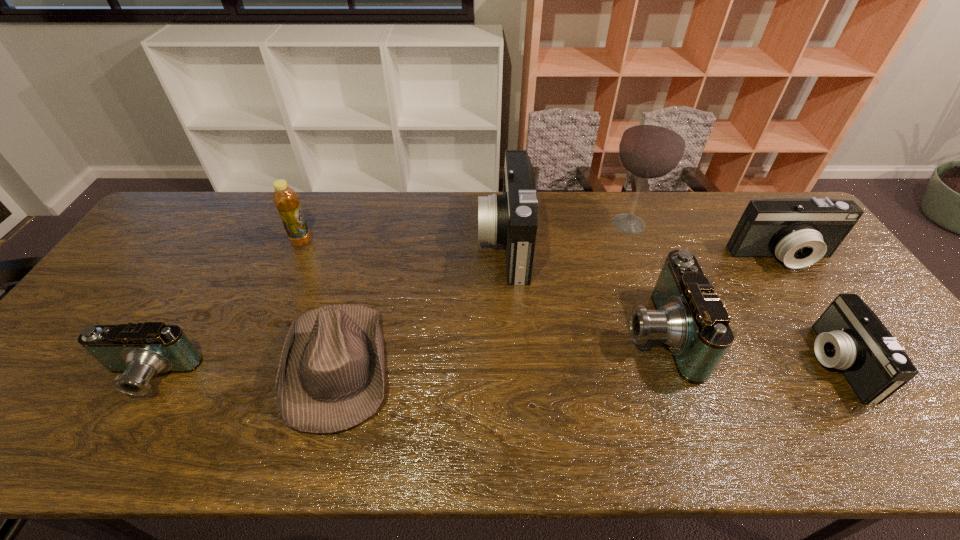
This screenshot has width=960, height=540. I want to click on free space located on the front-facing side of the third camcorder from right to left, so click(485, 333).

This screenshot has height=540, width=960. I want to click on vacant space located 0.190m on the lens of the nearest black camcorder, so click(737, 363).

You are a GUI agent. You are given a task and a screenshot of the screen. Output one action in this format:
    pyautogui.click(x=<x>, y=<y>)
    Task: Click on the vacant space positioned 0.320m on the lens of the nearest black camcorder
    This screenshot has height=540, width=960.
    Given the screenshot: What is the action you would take?
    pyautogui.click(x=684, y=363)

This screenshot has height=540, width=960. Find the location of `vacant region located on the lens of the nearest black camcorder`. vacant region located on the lens of the nearest black camcorder is located at coordinates (725, 363).

At what (x,y) coordinates should I click in order to perform the action: click on vacant space situated 0.130m on the back of the fedora. Please return your answer as a coordinate pair (x, y). The height and width of the screenshot is (540, 960). Looking at the image, I should click on (364, 273).

In order to click on alcohol positioned at the far edge in this screenshot , I will do `click(652, 146)`.

The width and height of the screenshot is (960, 540). Identify the location of camcorder positioned at the far edge. (510, 218).

The image size is (960, 540). What are the coordinates of `bottle present at the far edge` in the screenshot? It's located at (286, 201).

At what (x,y) coordinates should I click in order to perform the action: click on object that is at the near edge. Please return your answer as a coordinate pair (x, y). The width and height of the screenshot is (960, 540). Looking at the image, I should click on (330, 378).

Locate an element on the screen. The width and height of the screenshot is (960, 540). object that is at the left edge is located at coordinates (140, 351).